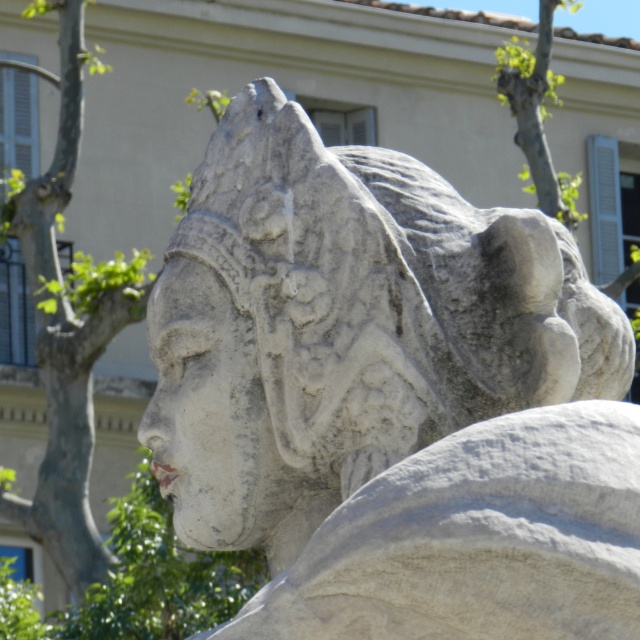
Question: Which object is farther from the camera taking this photo?

Choices:
 (A) green leafy tree at left
 (B) white stone head at center

Answer: (A)

Question: Which object is closer to the camera taking this photo?

Choices:
 (A) green leafy tree at left
 (B) white stone head at center

Answer: (B)

Question: Can you confirm if white stone head at center is thinner than green leafy tree at left?

Choices:
 (A) no
 (B) yes

Answer: (B)

Question: Is white stone head at center wider than green leafy tree at left?

Choices:
 (A) no
 (B) yes

Answer: (A)

Question: Which point appears farthest from the camera in this image?

Choices:
 (A) (300, 228)
 (B) (80, 502)

Answer: (B)

Question: From the image, what is the correct spatial relationship of white stone head at center in relation to green leafy tree at left?

Choices:
 (A) above
 (B) below

Answer: (B)